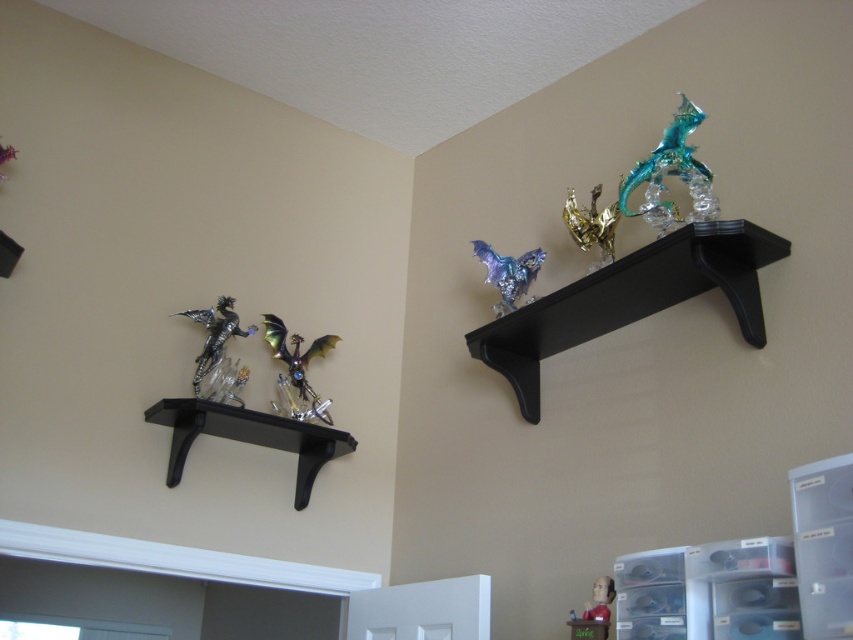
Who is shorter, black glossy shelf at upper right or black matte shelf at lower left?

With less height is black matte shelf at lower left.

Is point (689, 268) closer to camera compared to point (349, 433)?

Yes, it is in front of point (349, 433).

Is point (553, 348) more distant than point (207, 404)?

Yes, point (553, 348) is farther from viewer.

Locate an element on the screen. black glossy shelf at upper right is located at coordinates (631, 298).